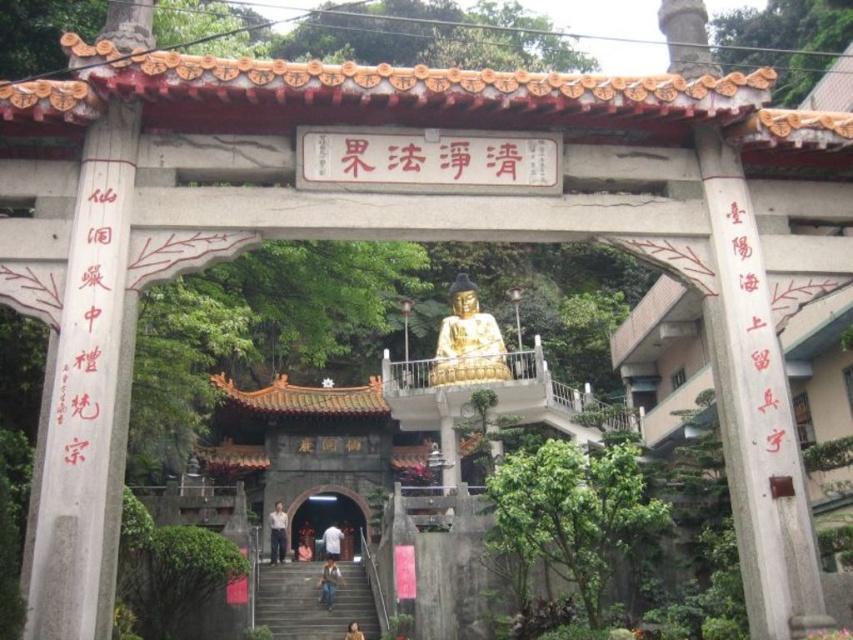
You are standing in front of the temple entrance and notice two points marked on the structure. The first point is at coordinate point (300,508) and the second is at point (355,636). Which point is closer to you as you face the entrance?

Point (300,508) is closer to you because it is further to the viewer than point (355,636).

You are a visitor approaching the temple entrance. You notice a gold polished statue at center and a smooth stone archway at center. Which object is closer to you as you stand at the entrance?

The gold polished statue at center is positioned over the smooth stone archway at center, meaning it is closer to you as you stand at the entrance.

You are standing at the entrance of the temple and see two points marked on the ground. One is labeled as point (341, 540) and the other as point (347, 632). Which point is closer to the temple entrance?

Point (347, 632) is closer to the temple entrance because point (341, 540) is behind it.